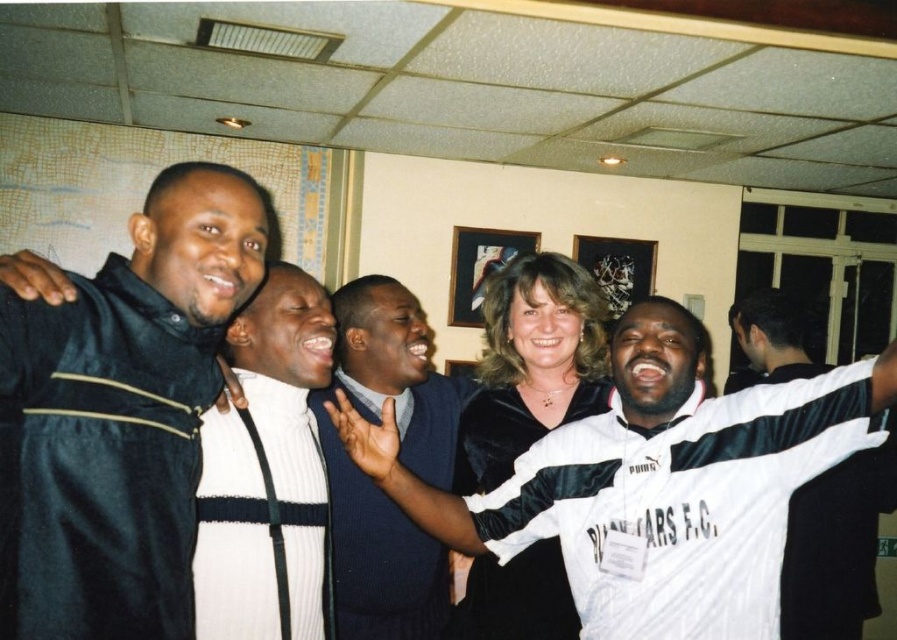
Which is behind, point (253, 388) or point (353, 531)?

The point (353, 531) is more distant.

Can you confirm if white ribbed sweater at center is thinner than velvet blue robe at center?

Correct, white ribbed sweater at center's width is less than velvet blue robe at center's.

Is point (214, 528) positioned before point (345, 541)?

Yes, point (214, 528) is closer to viewer.

I want to click on white ribbed sweater at center, so click(x=262, y=518).

Between point (512, 184) and point (495, 388), which one is positioned behind?

Positioned behind is point (512, 184).

Based on the photo, between velvet black dress at center and velvet black and white robe at center, which one appears on the right side from the viewer's perspective?

velvet black dress at center

Which is behind, point (630, 218) or point (463, 413)?

Positioned behind is point (630, 218).

Find the location of a particular element. This screenshot has height=640, width=897. velvet black dress at center is located at coordinates (536, 228).

Between white satin jacket at center and velvet black and white robe at center, which one appears on the right side from the viewer's perspective?

white satin jacket at center is more to the right.

Is the position of white satin jacket at center more distant than that of velvet black and white robe at center?

No, white satin jacket at center is closer to the viewer.

Image resolution: width=897 pixels, height=640 pixels. In order to click on white satin jacket at center in this screenshot , I will do `click(652, 483)`.

Find the location of a particular element. white satin jacket at center is located at coordinates (652, 483).